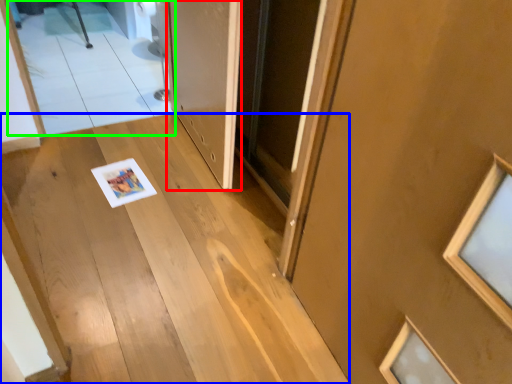
Question: Which object is the farthest from door (highlighted by a red box)? Choose among these: stairs (highlighted by a blue box) or mirror (highlighted by a green box).

Choices:
 (A) stairs
 (B) mirror

Answer: (B)